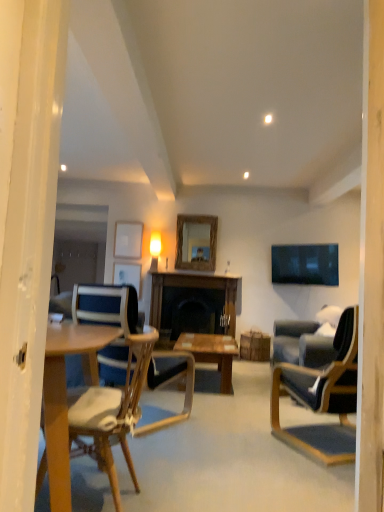
Image resolution: width=384 pixels, height=512 pixels. Find the location of `wooden/matte coffee table at center`. wooden/matte coffee table at center is located at coordinates (211, 353).

Identify the location of matte white picture frame at upper center, the 1th picture frame viewed from the top. This screenshot has width=384, height=512. (128, 240).

What do you see at coordinates (128, 275) in the screenshot? This screenshot has width=384, height=512. I see `matte wooden picture frame at upper center, the 2th picture frame in the top-to-bottom sequence` at bounding box center [128, 275].

In order to face matte wooden picture frame at upper center, arranged as the 1th picture frame when ordered from the bottom, should I rotate leftwards or rightwards?

To face it directly, rotate left by 8.825 degrees.

The image size is (384, 512). Describe the element at coordinates (323, 398) in the screenshot. I see `dark gray fabric chair at right, placed as the 2th chair when sorted from left to right` at that location.

Find the location of a particular element. This screenshot has height=512, width=384. rustic wood mirror at center is located at coordinates (196, 242).

From the image's perspective, between wooden/matte coffee table at center and matte wooden picture frame at upper center, the 2th picture frame in the top-to-bottom sequence, who is located below?

wooden/matte coffee table at center is shown below in the image.

Does point (204, 362) lie behind point (137, 266)?

No.

Is wooden/matte coffee table at center in front of or behind matte wooden picture frame at upper center, the 2th picture frame in the top-to-bottom sequence, in the image?

Visually, wooden/matte coffee table at center is located in front of matte wooden picture frame at upper center, the 2th picture frame in the top-to-bottom sequence.

Considering the sizes of matte white picture frame at upper center, the 1th picture frame viewed from the top, and wooden table at center in the image, is matte white picture frame at upper center, the 1th picture frame viewed from the top, wider or thinner than wooden table at center?

In the image, matte white picture frame at upper center, the 1th picture frame viewed from the top, appears to be more narrow than wooden table at center.

Is wooden table at center at the back of matte white picture frame at upper center, which ranks as the second picture frame in bottom-to-top order?

matte white picture frame at upper center, which ranks as the second picture frame in bottom-to-top order, is not turned away from wooden table at center.

Considering the relative positions of matte white picture frame at upper center, the 1th picture frame viewed from the top, and wooden table at center in the image provided, is matte white picture frame at upper center, the 1th picture frame viewed from the top, to the right of wooden table at center from the viewer's perspective?

No.

From the image's perspective, would you say matte wooden picture frame at upper center, the 2th picture frame in the top-to-bottom sequence, is shown under rustic wood mirror at center?

Indeed, from the image's perspective, matte wooden picture frame at upper center, the 2th picture frame in the top-to-bottom sequence, is shown beneath rustic wood mirror at center.

Based on the photo, choose the correct answer: Is matte wooden picture frame at upper center, arranged as the 1th picture frame when ordered from the bottom, inside rustic wood mirror at center or outside it?

matte wooden picture frame at upper center, arranged as the 1th picture frame when ordered from the bottom, is outside rustic wood mirror at center.

You are a GUI agent. You are given a task and a screenshot of the screen. Output one action in this format:
    pyautogui.click(x=<x>, y=<y>)
    Task: Click on the mirror that appears on the right of matte wooden picture frame at upper center, the 2th picture frame in the top-to-bottom sequence
    Image resolution: width=384 pixels, height=512 pixels.
    Given the screenshot: What is the action you would take?
    pyautogui.click(x=196, y=242)

Who is shorter, matte wooden picture frame at upper center, the 2th picture frame in the top-to-bottom sequence, or rustic wood mirror at center?

matte wooden picture frame at upper center, the 2th picture frame in the top-to-bottom sequence.

In the scene shown: Who is taller, wooden desk at left or rustic wood mirror at center?

Standing taller between the two is rustic wood mirror at center.

Which of these two, wooden desk at left or rustic wood mirror at center, is smaller?

With smaller size is rustic wood mirror at center.

Would you say rustic wood mirror at center is part of wooden desk at left's contents?

No, wooden desk at left does not contain rustic wood mirror at center.

Can you tell me how much dark gray fabric chair at right, acting as the first chair starting from the right, and wooden/matte coffee table at center differ in facing direction?

The angle between the facing direction of dark gray fabric chair at right, acting as the first chair starting from the right, and the facing direction of wooden/matte coffee table at center is 113 degrees.

Considering the relative positions of dark gray fabric chair at right, acting as the first chair starting from the right, and wooden/matte coffee table at center in the image provided, is dark gray fabric chair at right, acting as the first chair starting from the right, to the right of wooden/matte coffee table at center from the viewer's perspective?

Yes, dark gray fabric chair at right, acting as the first chair starting from the right, is to the right of wooden/matte coffee table at center.

Identify the location of coffee table on the left of dark gray fabric chair at right, acting as the first chair starting from the right. The height and width of the screenshot is (512, 384). (211, 353).

Does point (342, 355) come closer to viewer compared to point (210, 350)?

Yes.

Is wooden chair at center, the second chair in the right-to-left sequence, at the right side of matte wooden picture frame at upper center, the 2th picture frame in the top-to-bottom sequence?

Correct, you'll find wooden chair at center, the second chair in the right-to-left sequence, to the right of matte wooden picture frame at upper center, the 2th picture frame in the top-to-bottom sequence.

Is wooden chair at center, which ranks as the first chair in left-to-right order, oriented towards matte wooden picture frame at upper center, arranged as the 1th picture frame when ordered from the bottom?

No, wooden chair at center, which ranks as the first chair in left-to-right order, is not turned towards matte wooden picture frame at upper center, arranged as the 1th picture frame when ordered from the bottom.

Is wooden chair at center, which ranks as the first chair in left-to-right order, situated inside matte wooden picture frame at upper center, the 2th picture frame in the top-to-bottom sequence, or outside?

wooden chair at center, which ranks as the first chair in left-to-right order, is located beyond the bounds of matte wooden picture frame at upper center, the 2th picture frame in the top-to-bottom sequence.

Is wooden chair at center, the second chair in the right-to-left sequence, placed right next to matte wooden picture frame at upper center, the 2th picture frame in the top-to-bottom sequence?

wooden chair at center, the second chair in the right-to-left sequence, and matte wooden picture frame at upper center, the 2th picture frame in the top-to-bottom sequence, are not in contact.

Can we say rustic wood mirror at center lies outside wooden desk at left?

rustic wood mirror at center is positioned outside wooden desk at left.

In terms of width, does rustic wood mirror at center look wider or thinner when compared to wooden desk at left?

Considering their sizes, rustic wood mirror at center looks slimmer than wooden desk at left.

Is rustic wood mirror at center to the left of wooden desk at left from the viewer's perspective?

No.

Is rustic wood mirror at center aimed at wooden desk at left?

Yes, rustic wood mirror at center is oriented towards wooden desk at left.

Where is `coffee table that is on the right side of matte wooden picture frame at upper center, the 2th picture frame in the top-to-bottom sequence`? Image resolution: width=384 pixels, height=512 pixels. coffee table that is on the right side of matte wooden picture frame at upper center, the 2th picture frame in the top-to-bottom sequence is located at coordinates (211, 353).

Identify the location of table below the matte white picture frame at upper center, which ranks as the second picture frame in bottom-to-top order (from the image's perspective). (192, 302).

Looking at this image, looking at the image, which one is located further to rustic wood mirror at center, matte white picture frame at upper center, the 1th picture frame viewed from the top, or wooden desk at left?

wooden desk at left is positioned further to the anchor rustic wood mirror at center.

Looking at the image, which one is located closer to wooden/matte coffee table at center, wooden chair at center, the second chair in the right-to-left sequence, or dark gray fabric chair at right, acting as the first chair starting from the right?

Based on the image, wooden chair at center, the second chair in the right-to-left sequence, appears to be nearer to wooden/matte coffee table at center.

Estimate the real-world distances between objects in this image. Which object is closer to rustic wood mirror at center, matte wooden picture frame at upper center, the 2th picture frame in the top-to-bottom sequence, or wooden/matte coffee table at center?

matte wooden picture frame at upper center, the 2th picture frame in the top-to-bottom sequence, lies closer to rustic wood mirror at center than the other object.

Which object lies further to the anchor point wooden/matte coffee table at center, wooden table at center or wooden chair at center, the second chair in the right-to-left sequence?

Based on the image, wooden chair at center, the second chair in the right-to-left sequence, appears to be further to wooden/matte coffee table at center.

Based on their spatial positions, is wooden desk at left or wooden table at center closer to wooden/matte coffee table at center?

wooden table at center lies closer to wooden/matte coffee table at center than the other object.

Which object lies nearer to the anchor point wooden/matte coffee table at center, wooden chair at center, the second chair in the right-to-left sequence, or matte white picture frame at upper center, the 1th picture frame viewed from the top?

Among the two, wooden chair at center, the second chair in the right-to-left sequence, is located nearer to wooden/matte coffee table at center.

Looking at the image, which one is located further to wooden table at center, wooden/matte coffee table at center or matte wooden picture frame at upper center, arranged as the 1th picture frame when ordered from the bottom?

matte wooden picture frame at upper center, arranged as the 1th picture frame when ordered from the bottom.

Based on the photo, which object lies further to the anchor point matte white picture frame at upper center, the 1th picture frame viewed from the top, wooden chair at center, the second chair in the right-to-left sequence, or matte wooden picture frame at upper center, arranged as the 1th picture frame when ordered from the bottom?

Based on the image, wooden chair at center, the second chair in the right-to-left sequence, appears to be further to matte white picture frame at upper center, the 1th picture frame viewed from the top.

I want to click on table positioned between wooden/matte coffee table at center and matte white picture frame at upper center, which ranks as the second picture frame in bottom-to-top order, from near to far, so click(192, 302).

Image resolution: width=384 pixels, height=512 pixels. In order to click on picture frame between matte wooden picture frame at upper center, arranged as the 1th picture frame when ordered from the bottom, and wooden table at center from left to right in this screenshot , I will do `click(128, 240)`.

Locate an element on the screen. This screenshot has height=512, width=384. coffee table located between dark gray fabric chair at right, placed as the 2th chair when sorted from left to right, and matte wooden picture frame at upper center, the 2th picture frame in the top-to-bottom sequence, in the depth direction is located at coordinates (211, 353).

Where is `chair between dark gray fabric chair at right, placed as the 2th chair when sorted from left to right, and rustic wood mirror at center in the front-back direction`? This screenshot has height=512, width=384. chair between dark gray fabric chair at right, placed as the 2th chair when sorted from left to right, and rustic wood mirror at center in the front-back direction is located at coordinates (111, 324).